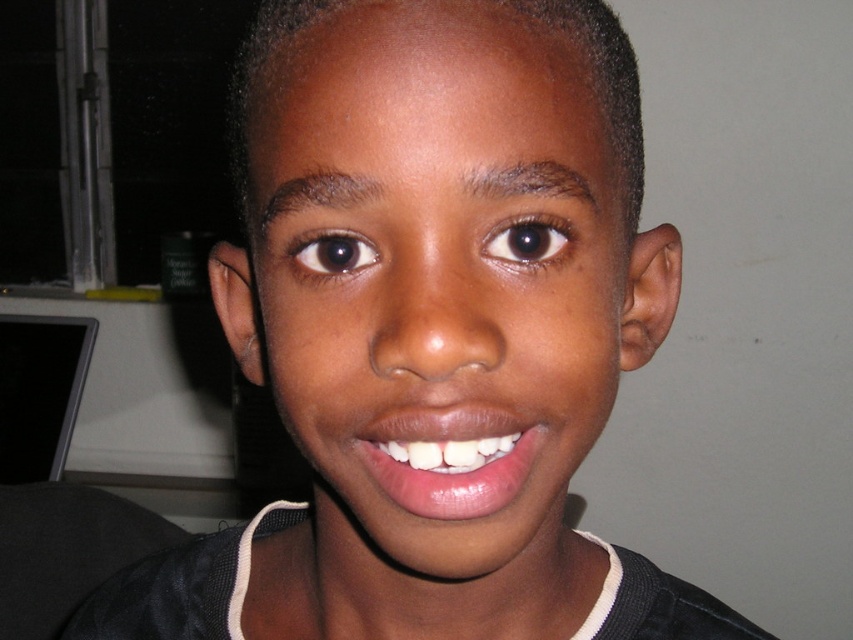
Looking at this image, looking at the image, which object is located below the other between the smooth glossy lips at center and the brown shiny eye at center?

The smooth glossy lips at center are positioned below the brown shiny eye at center.

Based on the scene description, which eye is located above the other? The brown matte eye at upper center or the brown shiny eye at center?

The brown matte eye at upper center is positioned over the brown shiny eye at center.